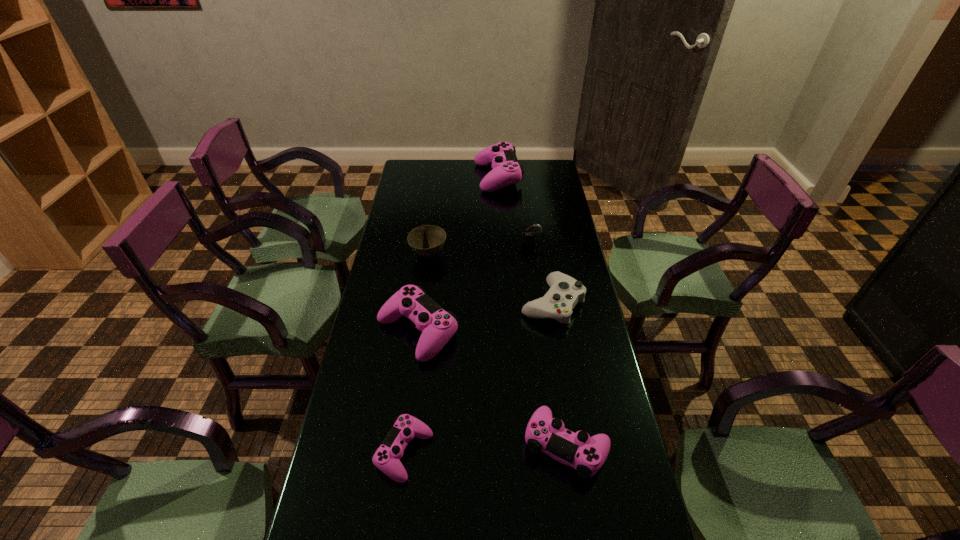
Locate an element on the screen. the tallest object is located at coordinates (506, 170).

I want to click on the biggest pink control, so click(x=506, y=170).

This screenshot has height=540, width=960. Identify the location of the second biggest pink control. (437, 326).

At what (x,y) coordinates should I click in order to perform the action: click on the second farthest pink control. Please return your answer as a coordinate pair (x, y). Looking at the image, I should click on (437, 326).

At what (x,y) coordinates should I click in order to perform the action: click on padlock. Please return your answer as a coordinate pair (x, y). Looking at the image, I should click on (528, 238).

You are a GUI agent. You are given a task and a screenshot of the screen. Output one action in this format:
    pyautogui.click(x=<x>, y=<y>)
    Task: Click on the bowl
    This screenshot has height=540, width=960.
    Given the screenshot: What is the action you would take?
    pyautogui.click(x=427, y=240)

I want to click on the third biggest pink control, so click(x=586, y=454).

Image resolution: width=960 pixels, height=540 pixels. I want to click on white control, so click(x=565, y=292).

Locate an element on the screen. The height and width of the screenshot is (540, 960). the shortest object is located at coordinates (386, 458).

Identify the location of the smallest pink control. The height and width of the screenshot is (540, 960). (386, 458).